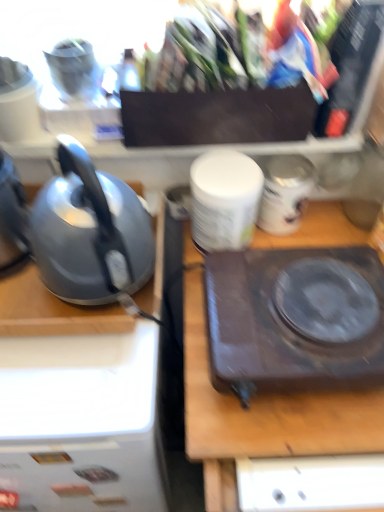
Locate an element on the screen. The width and height of the screenshot is (384, 512). vacant space in front of satin grey kettle at left is located at coordinates (76, 382).